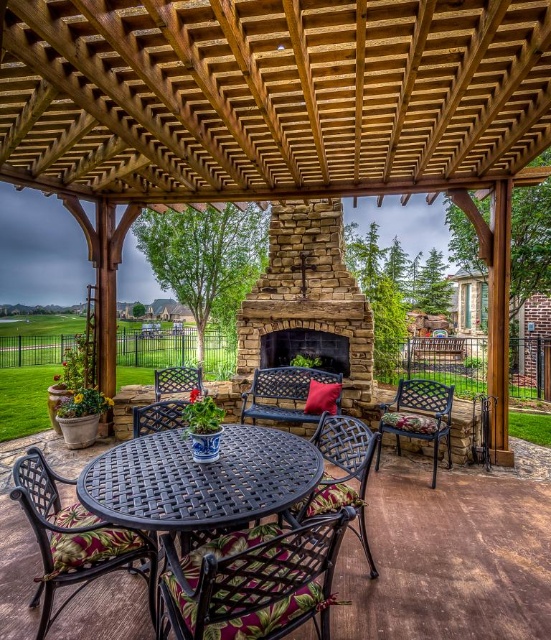
Question: Is metallic woven chair at center bigger than black woven metal chair at center?

Choices:
 (A) no
 (B) yes

Answer: (A)

Question: Which object is farther from the camera taking this photo?

Choices:
 (A) brown woven chair at lower left
 (B) natural stone fireplace at center
 (C) black woven table at center
 (D) metallic woven chair at center

Answer: (B)

Question: Estimate the real-world distances between objects in this image. Which object is farther from the black metal table at center?

Choices:
 (A) natural stone fireplace at center
 (B) black woven chair at center
 (C) metallic black bench at center

Answer: (B)

Question: Can you confirm if black metal table at center is bigger than black woven table at center?

Choices:
 (A) no
 (B) yes

Answer: (A)

Question: Which of the following is the farthest from the observer?

Choices:
 (A) metallic woven chair at center
 (B) rustic wicker chair at center

Answer: (B)

Question: Is natural stone fireplace at center positioned in front of black stone fireplace at center?

Choices:
 (A) no
 (B) yes

Answer: (B)